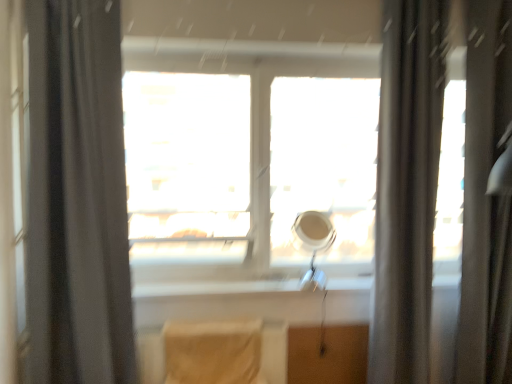
Question: Does transparent glass window at center contain matte gray curtain at right, the 1th curtain when ordered from right to left?

Choices:
 (A) yes
 (B) no

Answer: (B)

Question: From the image's perspective, does transparent glass window at center appear lower than matte gray curtain at right, which appears as the 2th curtain when viewed from the left?

Choices:
 (A) no
 (B) yes

Answer: (A)

Question: Is transparent glass window at center directly adjacent to matte gray curtain at right, the 1th curtain when ordered from right to left?

Choices:
 (A) no
 (B) yes

Answer: (A)

Question: Considering the relative positions of transparent glass window at center and matte gray curtain at right, the 1th curtain when ordered from right to left, in the image provided, is transparent glass window at center behind matte gray curtain at right, the 1th curtain when ordered from right to left,?

Choices:
 (A) yes
 (B) no

Answer: (A)

Question: Considering the relative sizes of transparent glass window at center and matte gray curtain at right, which appears as the 2th curtain when viewed from the left, in the image provided, is transparent glass window at center taller than matte gray curtain at right, which appears as the 2th curtain when viewed from the left,?

Choices:
 (A) no
 (B) yes

Answer: (A)

Question: Can you confirm if transparent glass window at center is bigger than matte gray curtain at right, the 1th curtain when ordered from right to left?

Choices:
 (A) no
 (B) yes

Answer: (B)

Question: Does silky gray shower curtain at right have a smaller size compared to black fabric curtain at left, which is the 1th curtain in left-to-right order?

Choices:
 (A) no
 (B) yes

Answer: (B)

Question: Is the depth of silky gray shower curtain at right less than that of black fabric curtain at left, placed as the 2th curtain when sorted from right to left?

Choices:
 (A) yes
 (B) no

Answer: (B)

Question: Considering the relative sizes of silky gray shower curtain at right and black fabric curtain at left, placed as the 2th curtain when sorted from right to left, in the image provided, is silky gray shower curtain at right thinner than black fabric curtain at left, placed as the 2th curtain when sorted from right to left,?

Choices:
 (A) yes
 (B) no

Answer: (A)

Question: From a real-world perspective, is silky gray shower curtain at right on black fabric curtain at left, which is the 1th curtain in left-to-right order?

Choices:
 (A) no
 (B) yes

Answer: (A)

Question: From a real-world perspective, does silky gray shower curtain at right sit lower than black fabric curtain at left, placed as the 2th curtain when sorted from right to left?

Choices:
 (A) no
 (B) yes

Answer: (B)

Question: Is the depth of silky gray shower curtain at right greater than that of black fabric curtain at left, which is the 1th curtain in left-to-right order?

Choices:
 (A) no
 (B) yes

Answer: (B)

Question: Considering the relative positions of matte gray curtain at right, the 1th curtain when ordered from right to left, and transparent glass window at center in the image provided, is matte gray curtain at right, the 1th curtain when ordered from right to left, behind transparent glass window at center?

Choices:
 (A) no
 (B) yes

Answer: (A)